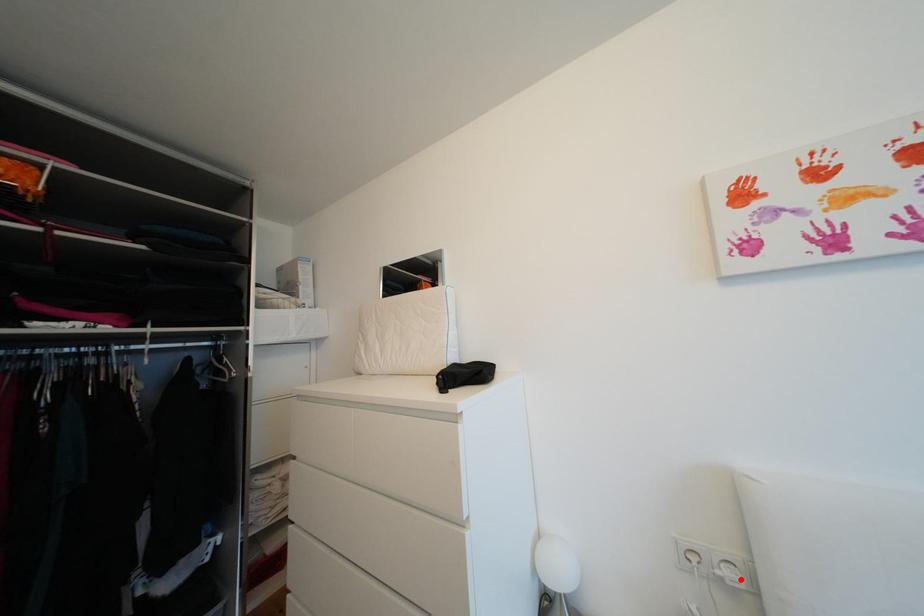
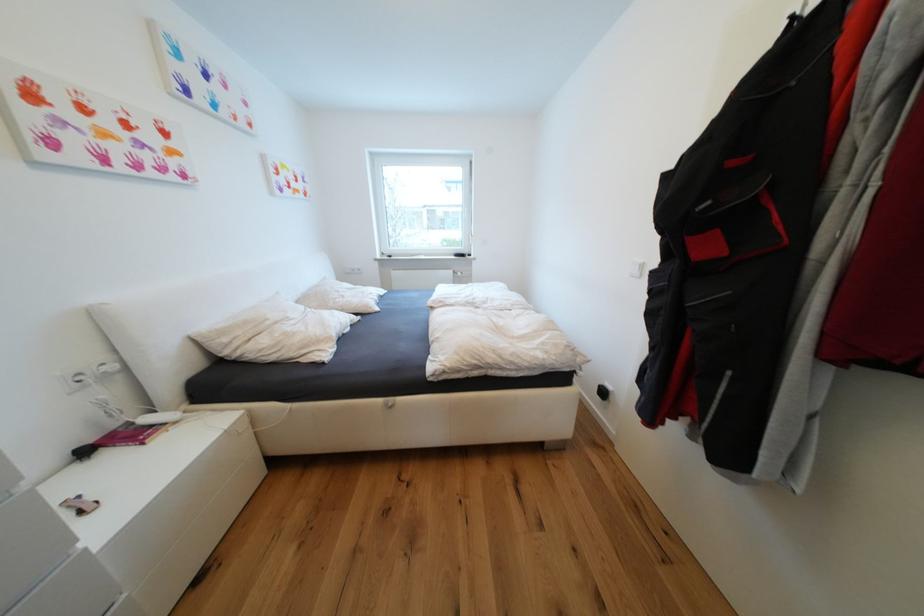
In the second image, find the point that corresponds to the highlighted location in the first image.

(119, 369)